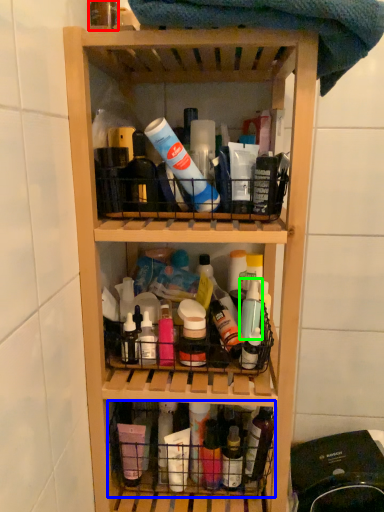
Question: Considering the real-world distances, which object is farthest from bottle (highlighted by a red box)? basket (highlighted by a blue box) or bottle (highlighted by a green box)?

Choices:
 (A) basket
 (B) bottle

Answer: (A)